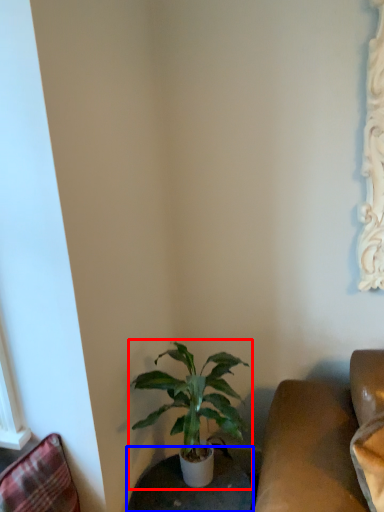
Question: Which object appears closest to the camera in this image, houseplant (highlighted by a red box) or round table (highlighted by a blue box)?

Choices:
 (A) houseplant
 (B) round table

Answer: (A)